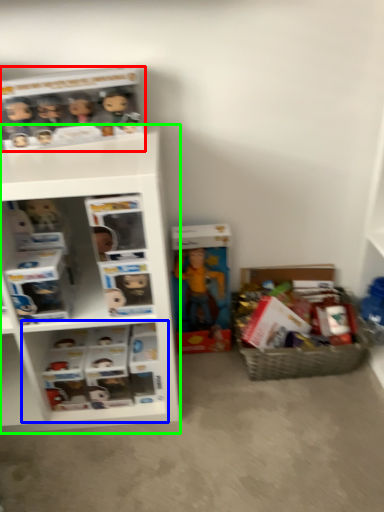
Question: Estimate the real-world distances between objects in this image. Which object is closer to collection (highlighted by a red box), cabinet (highlighted by a blue box) or shelf (highlighted by a green box)?

Choices:
 (A) cabinet
 (B) shelf

Answer: (B)